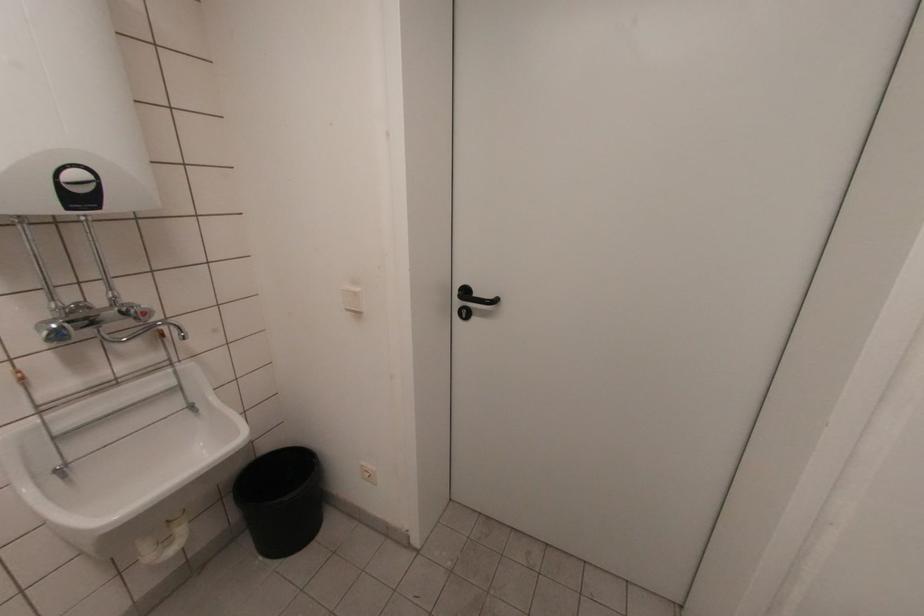
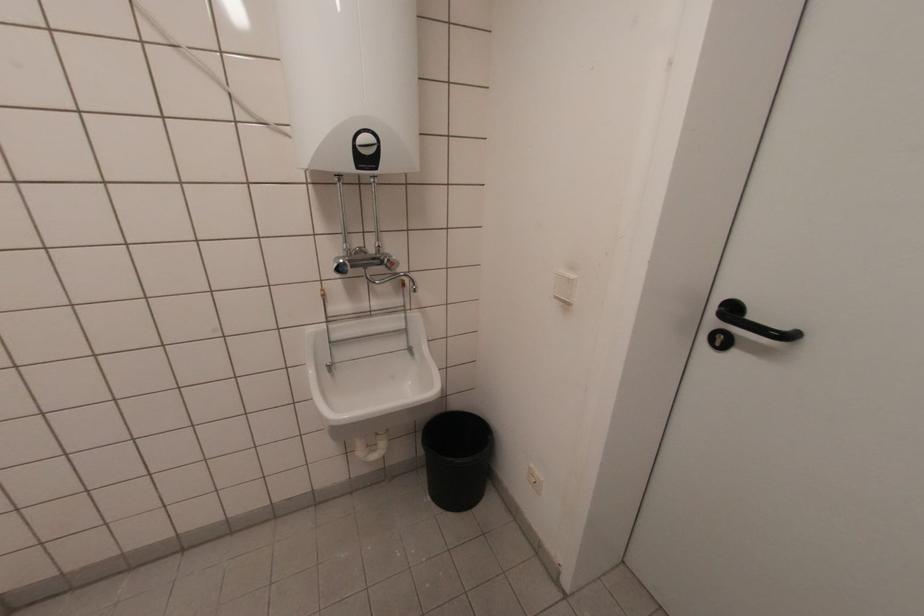
Locate, in the second image, the point that corresponds to pixel 465 315 in the first image.

(719, 344)